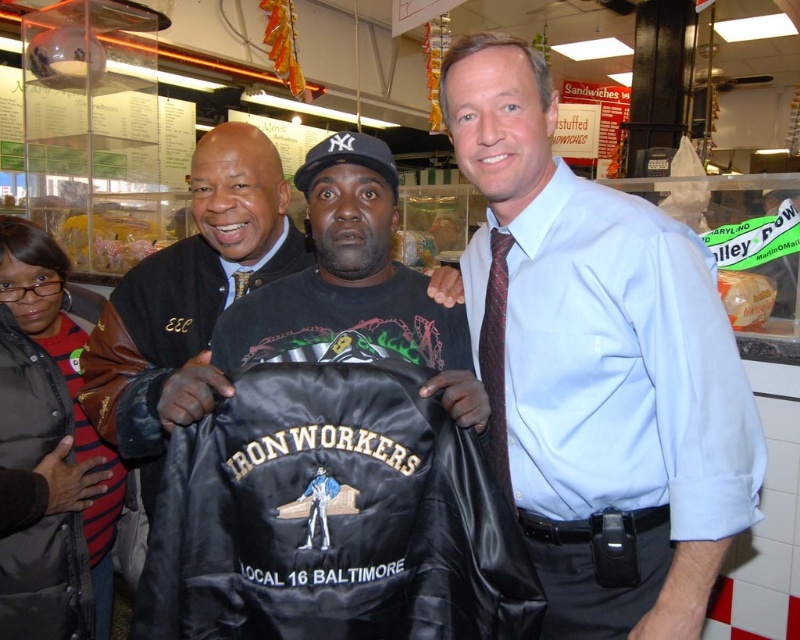
You are a customer standing in the deli and want to grab the black satin jacket at center from its current position. Considering your arm length is 28 inches, can you reach it without moving closer?

The black satin jacket at center is 37.23 inches away from you. Since your arm length is only 28 inches, you cannot reach it without moving closer.

You are a customer in the deli and want to choose between the dark red textured tie at right and the matte black tie at center. Which tie is closer to you?

The dark red textured tie at right is in front of the matte black tie at center, so it is closer to you.